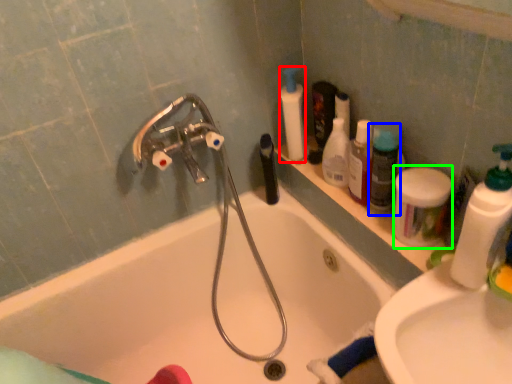
Question: Based on their relative distances, which object is nearer to cleaning product (highlighted by a red box)? Choose from cleaning product (highlighted by a blue box) and cleaning product (highlighted by a green box).

Choices:
 (A) cleaning product
 (B) cleaning product

Answer: (A)